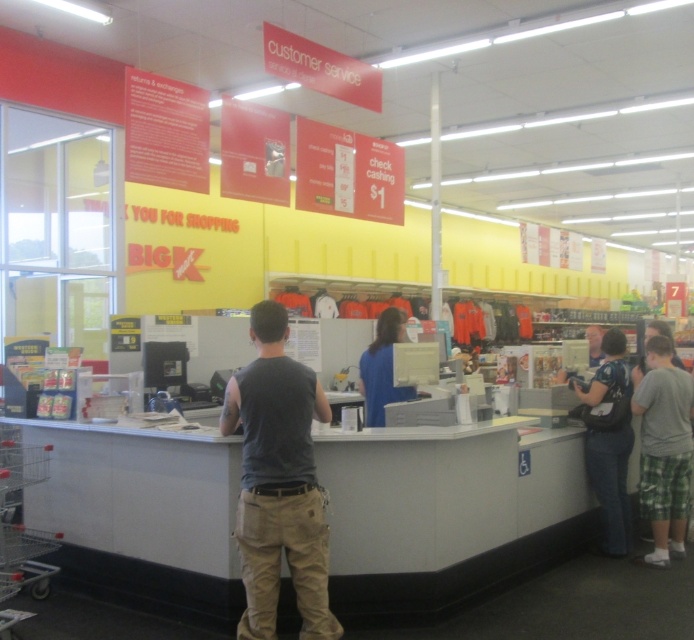
Question: Does denim pants at lower right appear over blue fabric shirt at center?

Choices:
 (A) no
 (B) yes

Answer: (A)

Question: Estimate the real-world distances between objects in this image. Which object is closer to the blue fabric shirt at center?

Choices:
 (A) denim pants at lower right
 (B) gray cotton tank top at center

Answer: (B)

Question: Which point appears closest to the camera in this image?

Choices:
 (A) (620, 522)
 (B) (393, 314)
 (C) (255, 608)

Answer: (C)

Question: Considering the relative positions of denim pants at lower right and blue fabric shirt at center in the image provided, where is denim pants at lower right located with respect to blue fabric shirt at center?

Choices:
 (A) below
 (B) above

Answer: (A)

Question: Considering the relative positions of gray cotton tank top at center and denim pants at lower right in the image provided, where is gray cotton tank top at center located with respect to denim pants at lower right?

Choices:
 (A) right
 (B) left

Answer: (B)

Question: Which point is farther to the camera?

Choices:
 (A) blue fabric shirt at center
 (B) denim pants at lower right

Answer: (B)